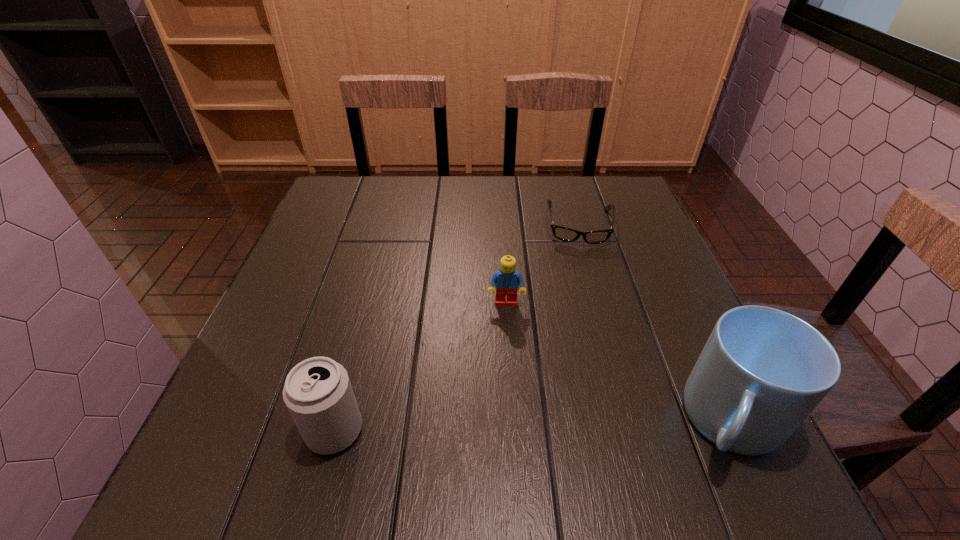
This screenshot has height=540, width=960. Find the location of `spectacles that is positioned at the right edge`. spectacles that is positioned at the right edge is located at coordinates (562, 233).

At what (x,y) coordinates should I click in order to perform the action: click on object at the near left corner. Please return your answer as a coordinate pair (x, y). This screenshot has width=960, height=540. Looking at the image, I should click on [318, 394].

You are a GUI agent. You are given a task and a screenshot of the screen. Output one action in this format:
    pyautogui.click(x=<x>, y=<y>)
    Task: Click on the object present at the far right corner
    The width and height of the screenshot is (960, 540).
    Given the screenshot: What is the action you would take?
    pyautogui.click(x=562, y=233)

What are the coordinates of `object at the near right corner` in the screenshot? It's located at (762, 371).

I want to click on vacant space at the far edge, so click(x=424, y=189).

The width and height of the screenshot is (960, 540). In order to click on free space at the near edge of the desktop in this screenshot , I will do `click(482, 412)`.

In the image, there is a desktop. Where is `free space at the left edge`? free space at the left edge is located at coordinates click(296, 280).

Identify the location of free region at the right edge of the desktop. This screenshot has height=540, width=960. (647, 225).

What are the coordinates of `vacant space at the far left corner of the desktop` in the screenshot? It's located at (361, 194).

The height and width of the screenshot is (540, 960). Identify the location of free spot at the near left corner of the desktop. (268, 398).